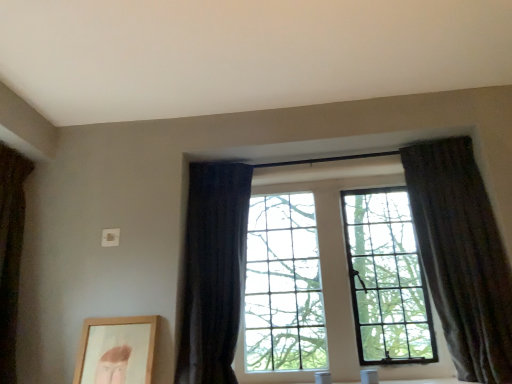
Question: Can you confirm if dark textured curtain at right, marked as the 3th curtain in a left-to-right arrangement, is thinner than dark fabric curtain at left, acting as the first curtain starting from the left?

Choices:
 (A) no
 (B) yes

Answer: (B)

Question: Considering the relative positions of dark textured curtain at right, marked as the 3th curtain in a left-to-right arrangement, and dark fabric curtain at left, which is the third curtain from right to left, in the image provided, is dark textured curtain at right, marked as the 3th curtain in a left-to-right arrangement, to the left of dark fabric curtain at left, which is the third curtain from right to left, from the viewer's perspective?

Choices:
 (A) no
 (B) yes

Answer: (A)

Question: Is dark textured curtain at right, which ranks as the first curtain in right-to-left order, bigger than dark fabric curtain at left, which is the third curtain from right to left?

Choices:
 (A) yes
 (B) no

Answer: (A)

Question: Can you confirm if dark textured curtain at right, which ranks as the first curtain in right-to-left order, is wider than dark fabric curtain at left, acting as the first curtain starting from the left?

Choices:
 (A) no
 (B) yes

Answer: (A)

Question: Is dark fabric curtain at left, which is the third curtain from right to left, at the back of dark textured curtain at right, marked as the 3th curtain in a left-to-right arrangement?

Choices:
 (A) no
 (B) yes

Answer: (A)

Question: From the image's perspective, is dark textured curtain at right, which ranks as the first curtain in right-to-left order, over dark fabric curtain at left, acting as the first curtain starting from the left?

Choices:
 (A) no
 (B) yes

Answer: (B)

Question: Does dark fabric curtain at left, which is the third curtain from right to left, have a greater height compared to wooden picture frame at lower left?

Choices:
 (A) no
 (B) yes

Answer: (B)

Question: Does dark fabric curtain at left, which is the third curtain from right to left, have a greater width compared to wooden picture frame at lower left?

Choices:
 (A) no
 (B) yes

Answer: (B)

Question: From a real-world perspective, is dark fabric curtain at left, acting as the first curtain starting from the left, physically above wooden picture frame at lower left?

Choices:
 (A) yes
 (B) no

Answer: (A)

Question: From the image's perspective, is dark fabric curtain at left, acting as the first curtain starting from the left, above wooden picture frame at lower left?

Choices:
 (A) no
 (B) yes

Answer: (B)

Question: Is dark fabric curtain at left, acting as the first curtain starting from the left, positioned with its back to wooden picture frame at lower left?

Choices:
 (A) no
 (B) yes

Answer: (A)

Question: Would you say dark fabric curtain at left, acting as the first curtain starting from the left, is outside wooden picture frame at lower left?

Choices:
 (A) no
 (B) yes

Answer: (B)

Question: Does dark fabric curtain at center, the 2th curtain viewed from the left, appear on the right side of dark fabric curtain at left, acting as the first curtain starting from the left?

Choices:
 (A) no
 (B) yes

Answer: (B)